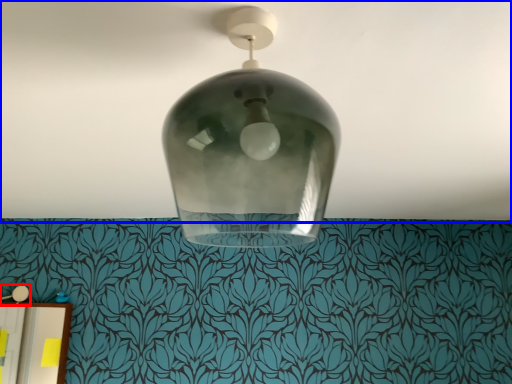
Question: Which of the following is the farthest to the observer, lamp (highlighted by a red box) or atmosphere (highlighted by a blue box)?

Choices:
 (A) lamp
 (B) atmosphere

Answer: (A)